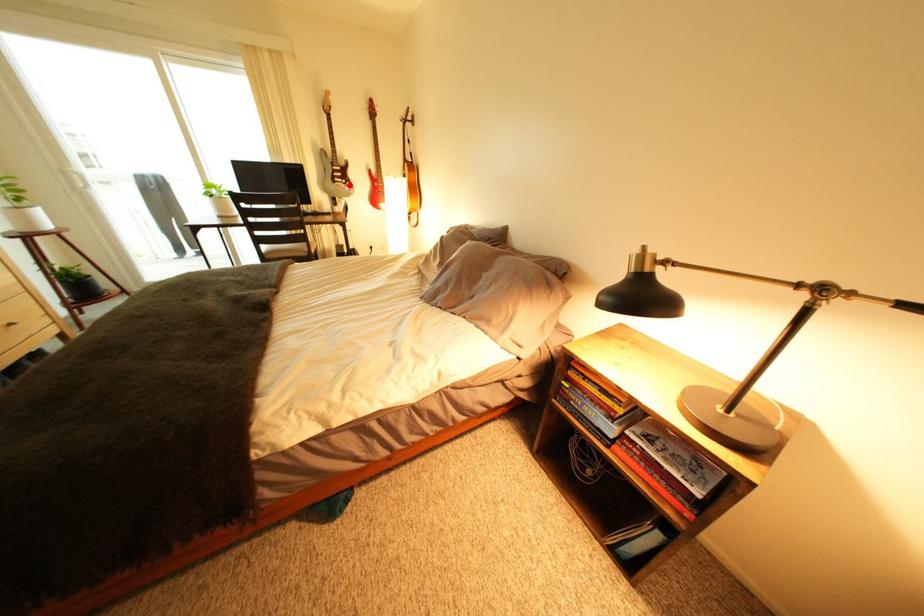
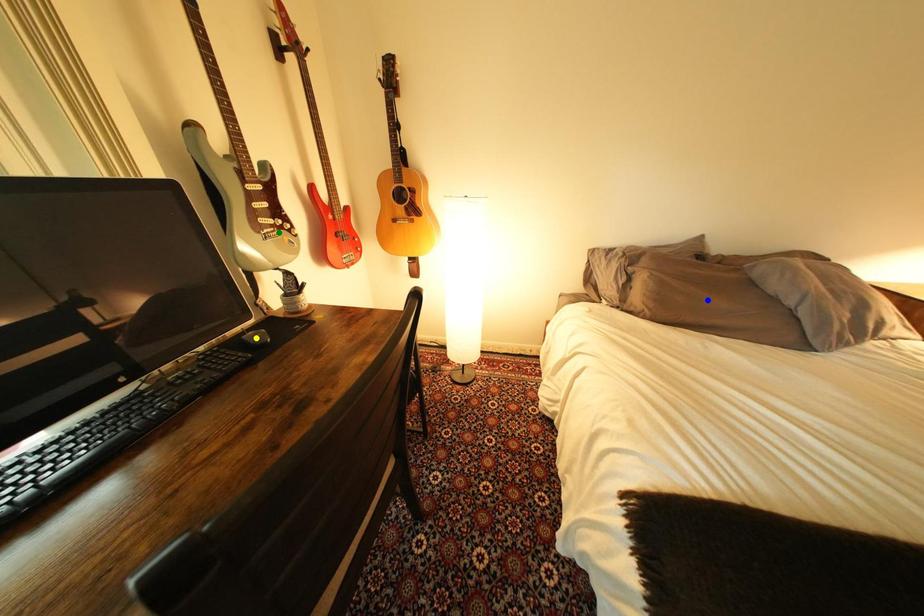
Question: I am providing you with two images of the same scene from different viewpoints. A red point is marked on the first image. You are given multiple points on the second image. Which spot in image 2 lines up with the point in image 1?

Choices:
 (A) blue point
 (B) yellow point
 (C) green point

Answer: (C)